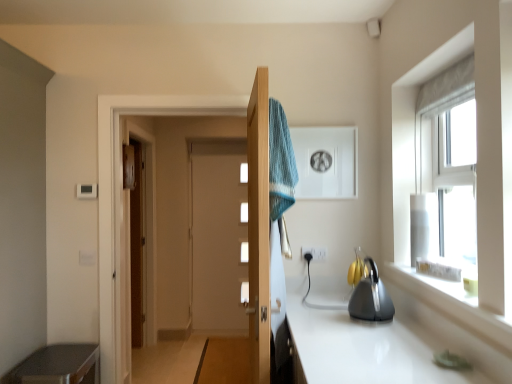
Question: From a real-world perspective, is metallic gray cabinet at lower left positioned above or below white plastic electric outlet at center?

Choices:
 (A) above
 (B) below

Answer: (B)

Question: Does point (97, 362) appear closer or farther from the camera than point (312, 248)?

Choices:
 (A) farther
 (B) closer

Answer: (B)

Question: Which of these objects is positioned closest to the blue knitted towel at center?

Choices:
 (A) metallic gray cabinet at lower left
 (B) white plastic electric outlet at center
 (C) white glossy medicine cabinet at upper center
 (D) wooden door at center
 (E) clear glass window at upper right

Answer: (D)

Question: Estimate the real-world distances between objects in this image. Which object is farther from the white plastic electric outlet at center?

Choices:
 (A) metallic gray cabinet at lower left
 (B) clear glass window at upper right
 (C) wooden door at center
 (D) white glossy medicine cabinet at upper center
 (E) blue knitted towel at center

Answer: (A)